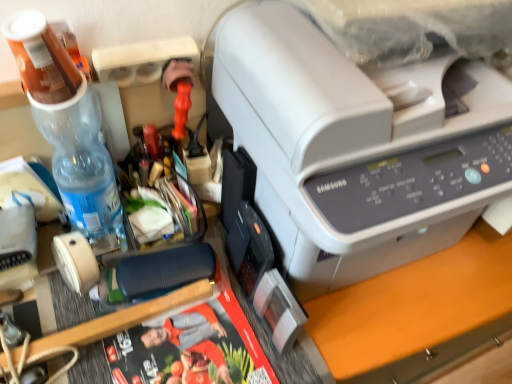
Find the location of a particular element. This screenshot has width=512, height=384. vacant space situated above matte black magazine at center (from a real-world perspective) is located at coordinates pos(183,338).